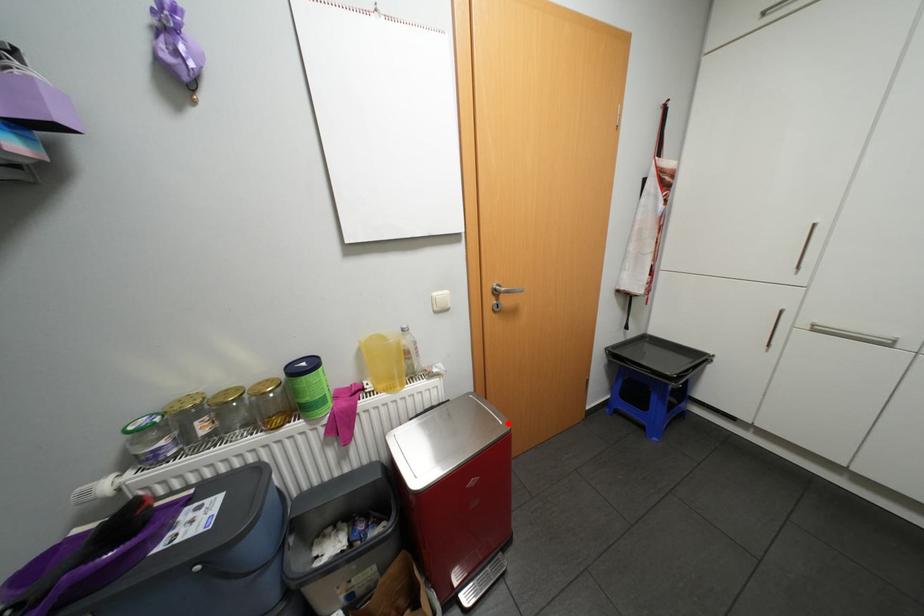
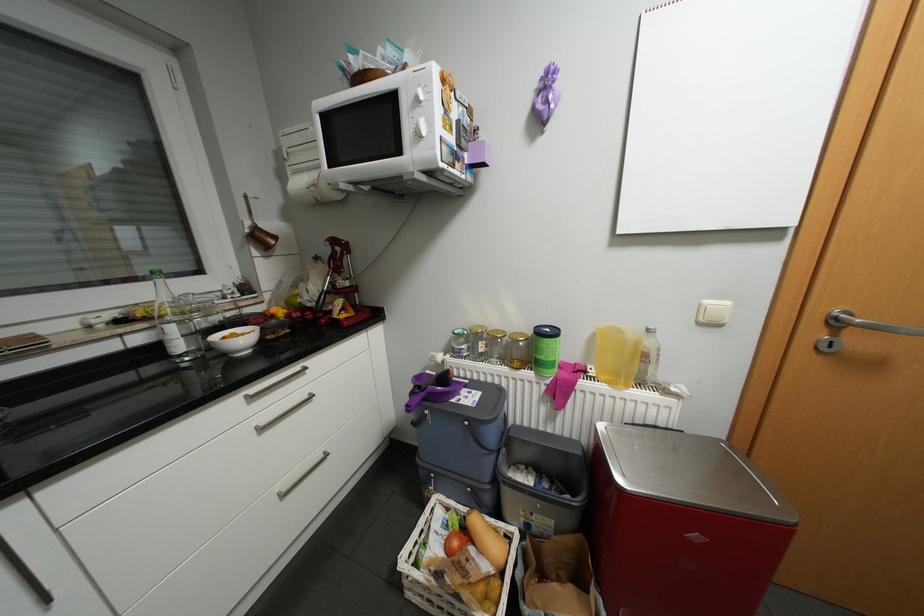
Question: I am providing you with two images of the same scene from different viewpoints. A red point is shown in image1. For the corresponding object point in image2, is it positioned nearer or farther from the camera?

Choices:
 (A) Nearer
 (B) Farther

Answer: (A)